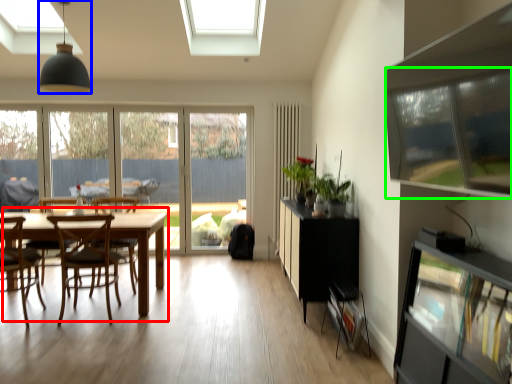
Question: Which is farther away from kitchen & dining room table (highlighted by a red box)? light fixture (highlighted by a blue box) or window screen (highlighted by a green box)?

Choices:
 (A) light fixture
 (B) window screen

Answer: (B)